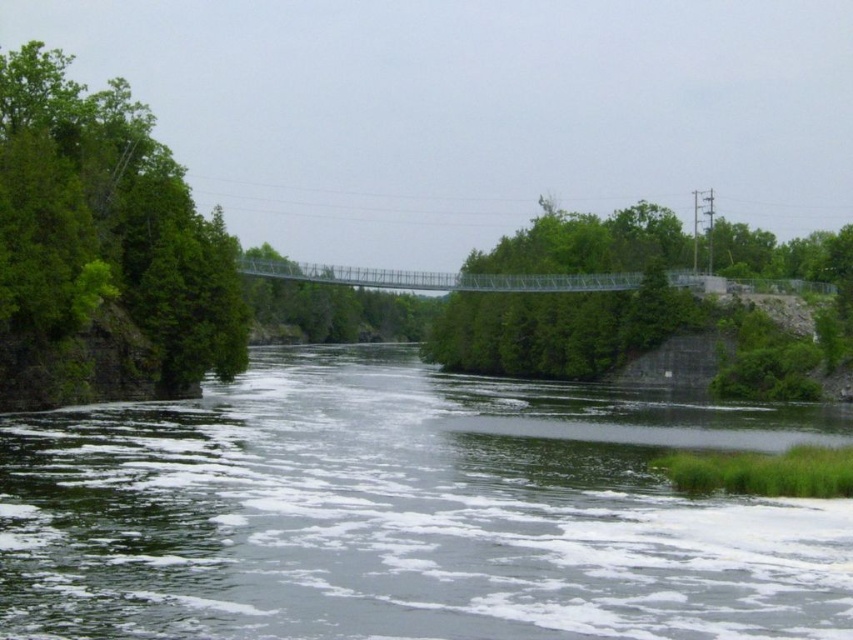
Is point (131, 365) more distant than point (583, 241)?

No, it is in front of (583, 241).

Identify the location of green leafy tree at left. (103, 250).

Is point (426, 636) positioned before point (579, 228)?

Yes, point (426, 636) is in front of point (579, 228).

Does point (247, 534) lie behind point (715, 264)?

No, (247, 534) is closer to viewer.

Between point (741, 637) and point (636, 305), which one is positioned in front?

Point (741, 637)

This screenshot has height=640, width=853. In order to click on greenish-gray water at center in this screenshot , I will do `click(408, 513)`.

Is greenish-gray water at center wider than green leafy tree at left?

Yes.

Which is in front, point (119, 493) or point (9, 218)?

Positioned in front is point (119, 493).

Identify the location of greenish-gray water at center. The height and width of the screenshot is (640, 853). (408, 513).